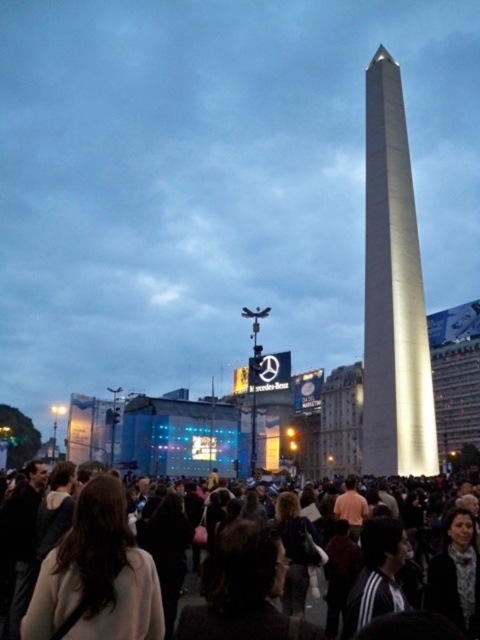
Which is more to the left, shiny metallic obelisk at center or dark brown hair at center?

dark brown hair at center

Is shiny metallic obelisk at center above dark brown hair at center?

Indeed, shiny metallic obelisk at center is positioned over dark brown hair at center.

Based on the photo, who is more distant from viewer, (385, 330) or (478, 529)?

Point (385, 330)

Identify the location of shiny metallic obelisk at center. The width and height of the screenshot is (480, 640). (393, 292).

This screenshot has width=480, height=640. What are the coordinates of `light brown hair at center` in the screenshot? It's located at (96, 577).

Can you confirm if light brown hair at center is positioned to the right of dark brown hair at center?

In fact, light brown hair at center is to the left of dark brown hair at center.

Does point (60, 624) come behind point (325, 496)?

No, it is not.

The width and height of the screenshot is (480, 640). I want to click on light brown hair at center, so click(96, 577).

Between shiny metallic obelisk at center and light brown hair at center, which one is positioned higher?

shiny metallic obelisk at center is above.

Can you confirm if shiny metallic obelisk at center is taller than light brown hair at center?

Yes.

Does point (393, 328) come closer to viewer compared to point (88, 563)?

No, it is behind (88, 563).

At what (x,y) coordinates should I click in order to perform the action: click on shiny metallic obelisk at center. Please return your answer as a coordinate pair (x, y). The height and width of the screenshot is (640, 480). Looking at the image, I should click on (393, 292).